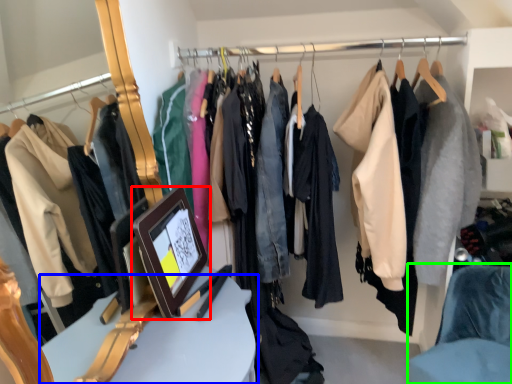
Question: Which object is the closest to the picture frame (highlighted by a red box)? Choose among these: furniture (highlighted by a blue box) or chair (highlighted by a green box).

Choices:
 (A) furniture
 (B) chair

Answer: (A)